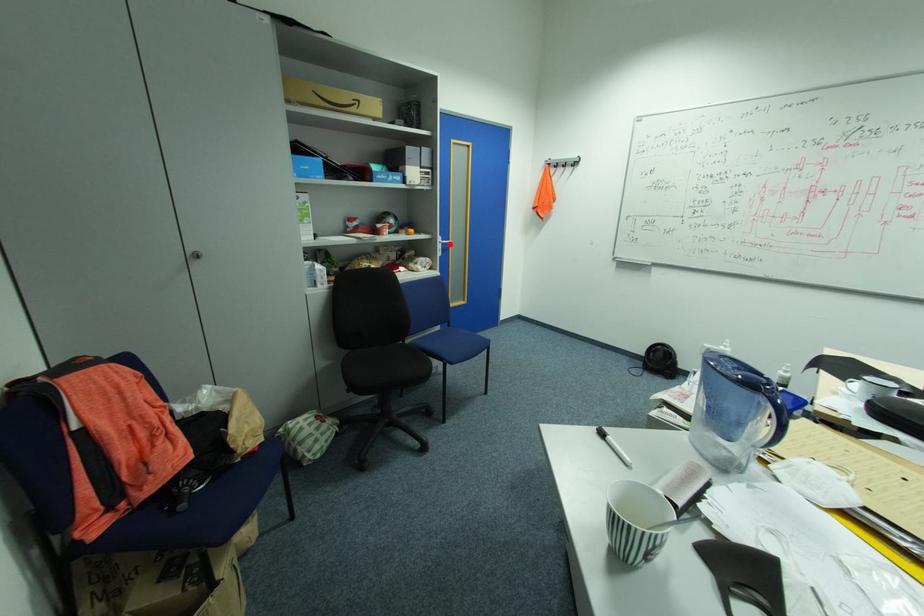
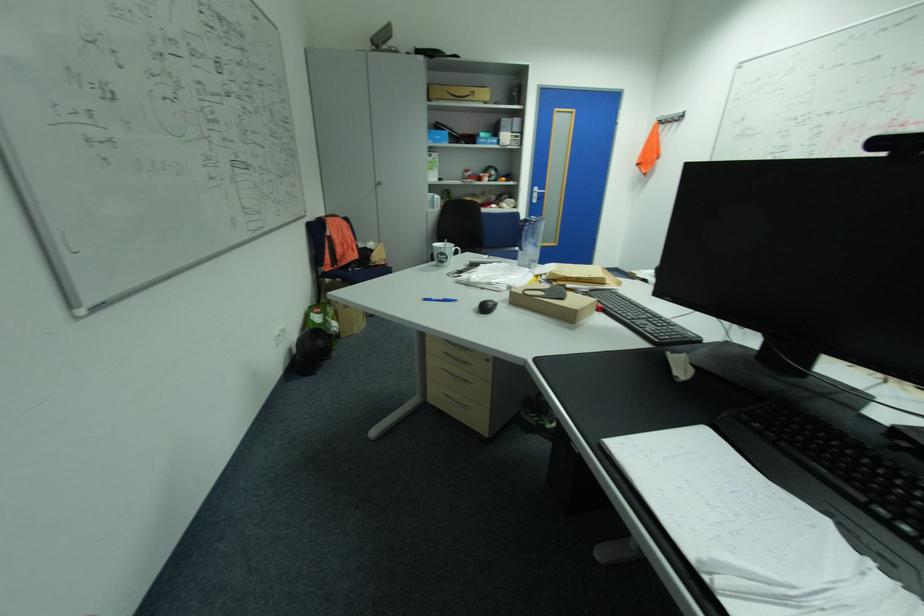
Where in the second image is the point corresponding to the highlighted location from the first image?

(544, 193)